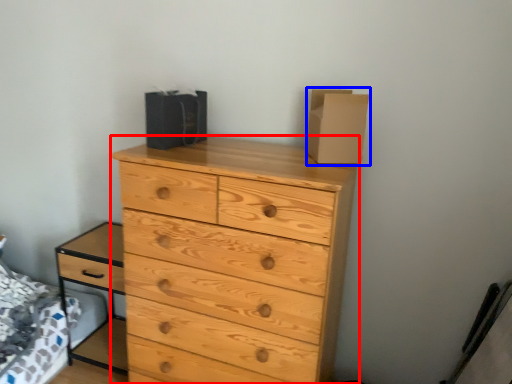
Question: Which point is closer to the camera, chest of drawers (highlighted by a red box) or cardboard box (highlighted by a blue box)?

Choices:
 (A) chest of drawers
 (B) cardboard box

Answer: (A)